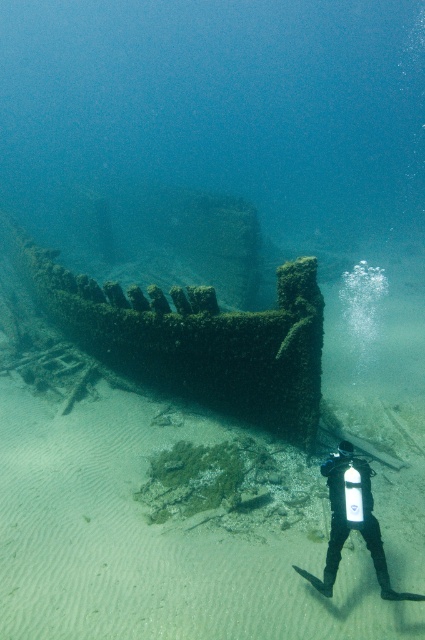
Question: Is rusty metal shipwreck at center above black rubber wetsuit at lower center?

Choices:
 (A) yes
 (B) no

Answer: (A)

Question: Which object appears farthest from the camera in this image?

Choices:
 (A) rusty metal shipwreck at center
 (B) black rubber wetsuit at lower center

Answer: (A)

Question: Is rusty metal shipwreck at center to the left of black rubber wetsuit at lower center from the viewer's perspective?

Choices:
 (A) no
 (B) yes

Answer: (B)

Question: Observing the image, what is the correct spatial positioning of rusty metal shipwreck at center in reference to black rubber wetsuit at lower center?

Choices:
 (A) above
 (B) below

Answer: (A)

Question: Among these points, which one is farthest from the camera?

Choices:
 (A) (274, 428)
 (B) (319, 579)

Answer: (A)

Question: Which point is farther to the camera?

Choices:
 (A) black rubber wetsuit at lower center
 (B) rusty metal shipwreck at center

Answer: (B)